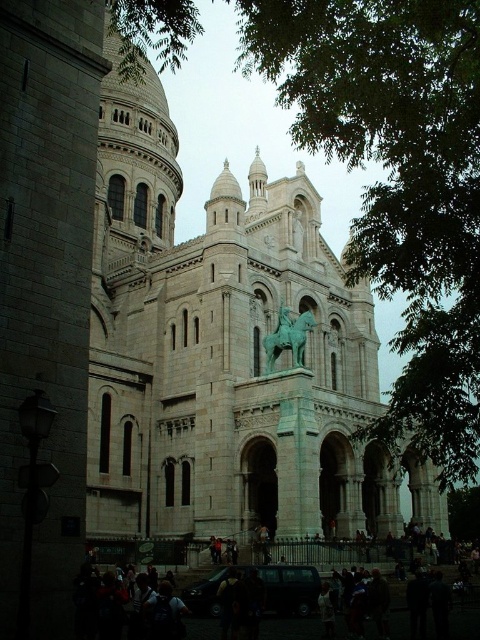
Who is more distant from viewer, (x=332, y=4) or (x=296, y=336)?

The point (x=296, y=336) is more distant.

The width and height of the screenshot is (480, 640). I want to click on green leafy tree at upper right, so click(x=396, y=182).

Where is `green leafy tree at upper right`? This screenshot has height=640, width=480. green leafy tree at upper right is located at coordinates (396, 182).